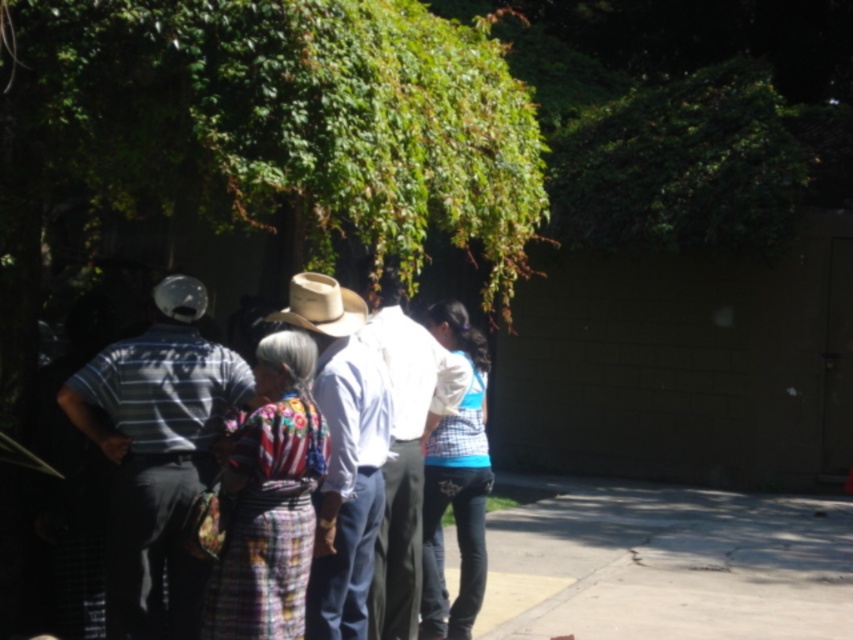
Can you confirm if striped cotton shirt at left is positioned below light brown straw cowboy hat at center?

Yes, striped cotton shirt at left is below light brown straw cowboy hat at center.

How distant is striped cotton shirt at left from light brown straw cowboy hat at center?

The distance of striped cotton shirt at left from light brown straw cowboy hat at center is 28.72 inches.

From the picture: Measure the distance between striped cotton shirt at left and camera.

4.58 meters

Where is `striped cotton shirt at left`? This screenshot has width=853, height=640. striped cotton shirt at left is located at coordinates (157, 454).

Is the position of light brown woven hat at center more distant than that of white cotton shirt at center?

No, it is not.

In the scene shown: Does light brown woven hat at center have a lesser height compared to white cotton shirt at center?

Correct, light brown woven hat at center is not as tall as white cotton shirt at center.

Where is `light brown woven hat at center`? The image size is (853, 640). light brown woven hat at center is located at coordinates (343, 452).

Which is in front, point (364, 586) or point (358, 301)?

Positioned in front is point (364, 586).

Is light brown woven hat at center thinner than light brown straw cowboy hat at center?

No, light brown woven hat at center is not thinner than light brown straw cowboy hat at center.

Locate an element on the screen. light brown woven hat at center is located at coordinates (343, 452).

At what (x,y) coordinates should I click in order to perform the action: click on light brown woven hat at center. Please return your answer as a coordinate pair (x, y). Image resolution: width=853 pixels, height=640 pixels. Looking at the image, I should click on (343, 452).